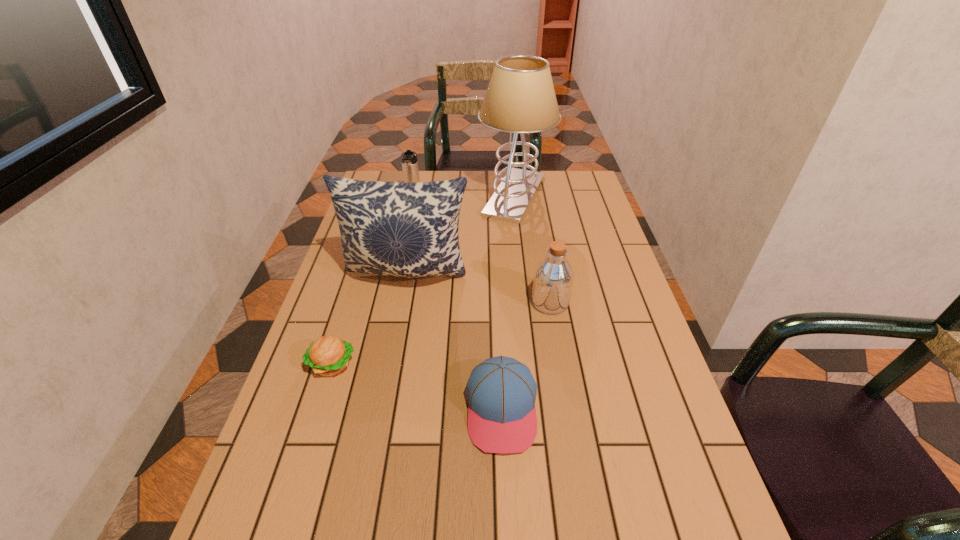
Identify the location of free location located on the right of the shortest object. This screenshot has width=960, height=540. (456, 364).

This screenshot has height=540, width=960. What are the coordinates of `table lamp situated at the far edge` in the screenshot? It's located at (520, 98).

Locate an element on the screen. thermos bottle situated at the far edge is located at coordinates (410, 169).

This screenshot has height=540, width=960. I want to click on cushion at the left edge, so click(x=403, y=229).

Identify the location of hamburger that is at the left edge. (328, 355).

The width and height of the screenshot is (960, 540). In the image, there is a desktop. What are the coordinates of `vacant space at the far edge` in the screenshot? It's located at (442, 180).

This screenshot has height=540, width=960. In the image, there is a desktop. What are the coordinates of `vacant space at the left edge` in the screenshot? It's located at (305, 458).

What are the coordinates of `free space at the right edge of the desktop` in the screenshot? It's located at (579, 273).

You are a GUI agent. You are given a task and a screenshot of the screen. Output one action in this format:
    pyautogui.click(x=<x>, y=<y>)
    Task: Click on the blank space at the far right corner of the desktop
    This screenshot has width=960, height=540.
    Given the screenshot: What is the action you would take?
    pyautogui.click(x=579, y=194)

Locate an element on the screen. This screenshot has width=960, height=540. vacant space that is in between the thermos bottle and the shortest object is located at coordinates (372, 284).